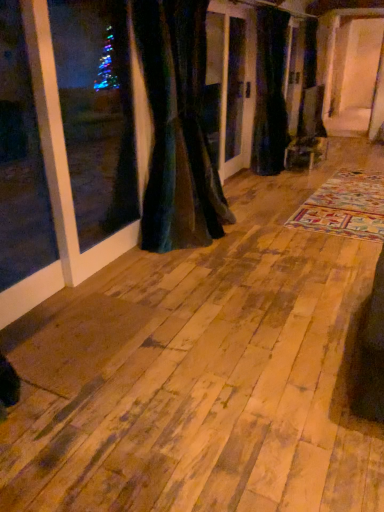
Question: Can velvet dark green curtain at center, which is the 2th curtain from right to left, be found inside velvet dark green curtain at center, acting as the 1th curtain starting from the back?

Choices:
 (A) yes
 (B) no

Answer: (B)

Question: Can you confirm if velvet dark green curtain at center, the 2th curtain from the left, is smaller than velvet dark green curtain at center, the 1th curtain viewed from the left?

Choices:
 (A) no
 (B) yes

Answer: (B)

Question: From the image's perspective, does velvet dark green curtain at center, which is the 2th curtain in front-to-back order, appear lower than velvet dark green curtain at center, the 1th curtain viewed from the left?

Choices:
 (A) yes
 (B) no

Answer: (B)

Question: Could you tell me if velvet dark green curtain at center, the 2th curtain from the left, is facing velvet dark green curtain at center, arranged as the 2th curtain when viewed from the back?

Choices:
 (A) yes
 (B) no

Answer: (B)

Question: Is the depth of velvet dark green curtain at center, which is the 2th curtain in front-to-back order, greater than that of velvet dark green curtain at center, the first curtain positioned from the front?

Choices:
 (A) no
 (B) yes

Answer: (B)

Question: Can you confirm if velvet dark green curtain at center, which is the 2th curtain in front-to-back order, is shorter than velvet dark green curtain at center, arranged as the 2th curtain when viewed from the back?

Choices:
 (A) no
 (B) yes

Answer: (A)

Question: Is velvet dark green curtain at center, which is the 2th curtain in front-to-back order, a part of velvet dark green curtain at center, which is the 2th curtain from right to left?

Choices:
 (A) yes
 (B) no

Answer: (B)

Question: Does velvet dark green curtain at center, which is the 2th curtain from right to left, have a smaller size compared to velvet dark green curtain at center, which is the 2th curtain in front-to-back order?

Choices:
 (A) yes
 (B) no

Answer: (B)

Question: From a real-world perspective, is velvet dark green curtain at center, which is the 2th curtain from right to left, over velvet dark green curtain at center, which is the 2th curtain in front-to-back order?

Choices:
 (A) no
 (B) yes

Answer: (A)

Question: Is velvet dark green curtain at center, the 1th curtain viewed from the left, placed right next to velvet dark green curtain at center, which is the 2th curtain in front-to-back order?

Choices:
 (A) no
 (B) yes

Answer: (A)

Question: Is velvet dark green curtain at center, arranged as the 2th curtain when viewed from the back, aimed at velvet dark green curtain at center, the 1th curtain when ordered from right to left?

Choices:
 (A) yes
 (B) no

Answer: (B)

Question: From the image's perspective, is velvet dark green curtain at center, the first curtain positioned from the front, below velvet dark green curtain at center, the 1th curtain when ordered from right to left?

Choices:
 (A) yes
 (B) no

Answer: (A)

Question: From their relative heights in the image, would you say velvet dark green curtain at center, the 2th curtain from the left, is taller or shorter than velvet dark green curtain at center, arranged as the 2th curtain when viewed from the back?

Choices:
 (A) tall
 (B) short

Answer: (A)